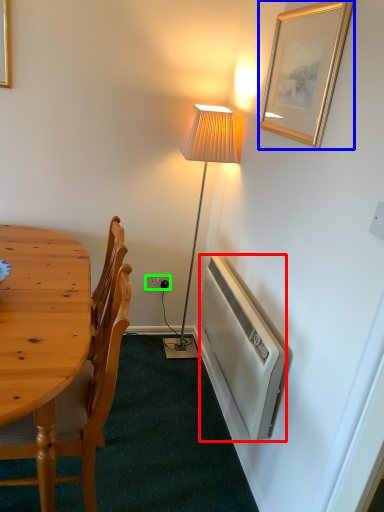
Question: Estimate the real-world distances between objects in this image. Which object is farther from radiator (highlighted by a red box), picture frame (highlighted by a blue box) or power outlet (highlighted by a green box)?

Choices:
 (A) picture frame
 (B) power outlet

Answer: (B)